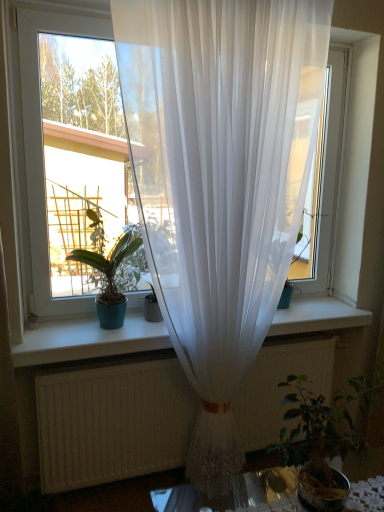
Question: Is green leafy plant at lower right, the first houseplant ordered from the bottom, inside or outside of transparent white curtain at center?

Choices:
 (A) inside
 (B) outside

Answer: (B)

Question: From their relative heights in the image, would you say green leafy plant at lower right, marked as the second houseplant in a top-to-bottom arrangement, is taller or shorter than transparent white curtain at center?

Choices:
 (A) tall
 (B) short

Answer: (B)

Question: Considering the real-world distances, which object is closest to the matte green pot at left, the second houseplant positioned from the right?

Choices:
 (A) green leafy plant at lower right, marked as the second houseplant in a top-to-bottom arrangement
 (B) transparent white curtain at center
 (C) translucent white curtain at center

Answer: (B)

Question: Estimate the real-world distances between objects in this image. Which object is closer to the transparent white curtain at center?

Choices:
 (A) matte green pot at left, acting as the 1th houseplant starting from the left
 (B) green leafy plant at lower right, marked as the 2th houseplant in a left-to-right arrangement
 (C) translucent white curtain at center

Answer: (A)